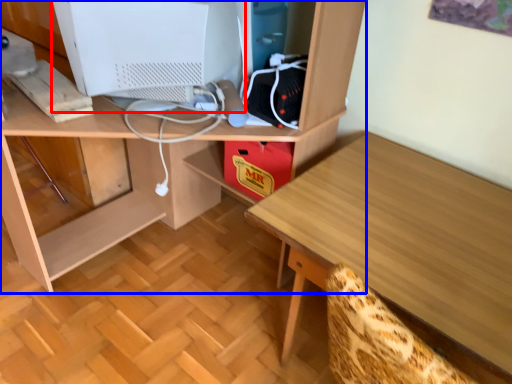
Question: Which object is closer to the camera taking this photo, computer monitor (highlighted by a red box) or desk (highlighted by a blue box)?

Choices:
 (A) computer monitor
 (B) desk

Answer: (B)